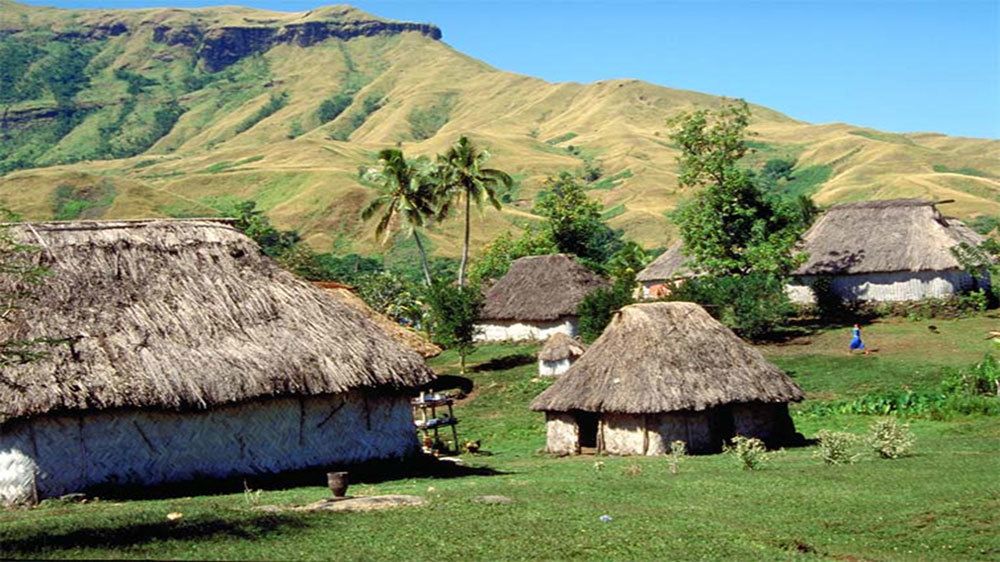
I want to click on basket, so click(x=335, y=484).